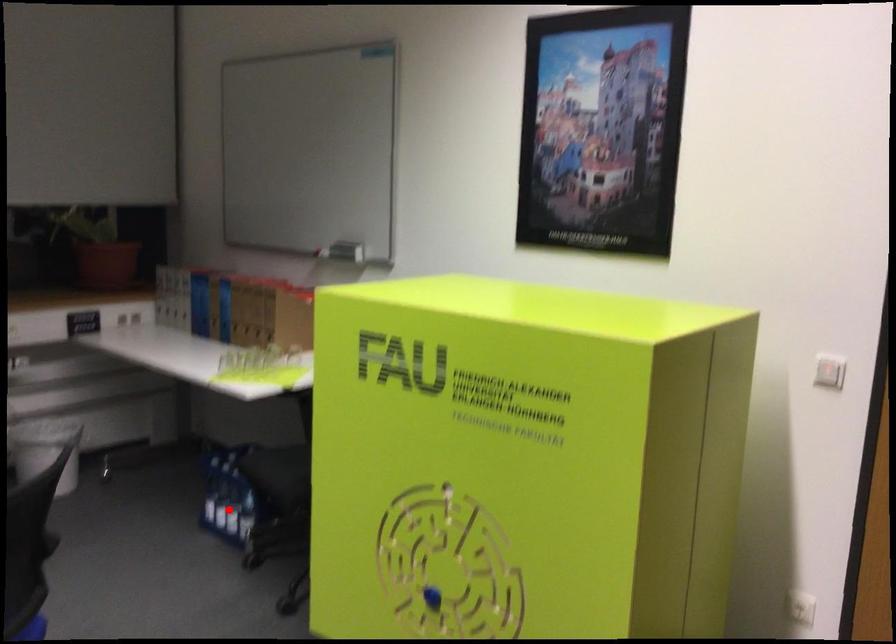
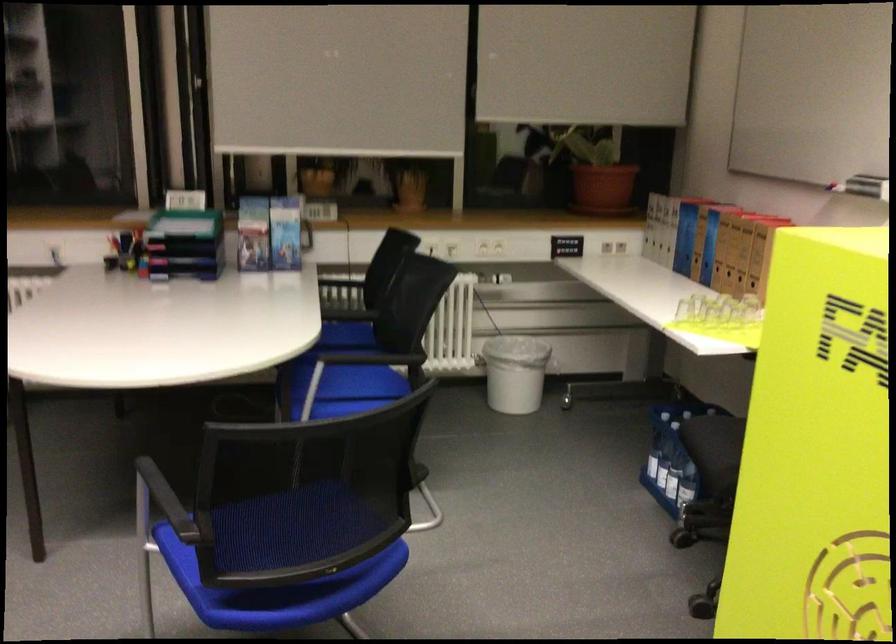
Question: I am providing you with two images of the same scene from different viewpoints. A red point is shown in image1. For the corresponding object point in image2, is it positioned nearer or farther from the camera?

Choices:
 (A) Nearer
 (B) Farther

Answer: (A)